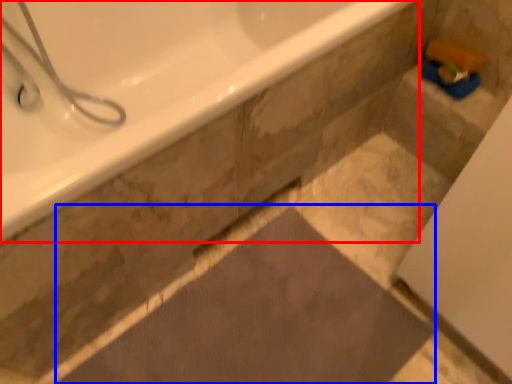
Question: Which of the following is the farthest to the observer, bathtub (highlighted by a red box) or bath mat (highlighted by a blue box)?

Choices:
 (A) bathtub
 (B) bath mat

Answer: (B)